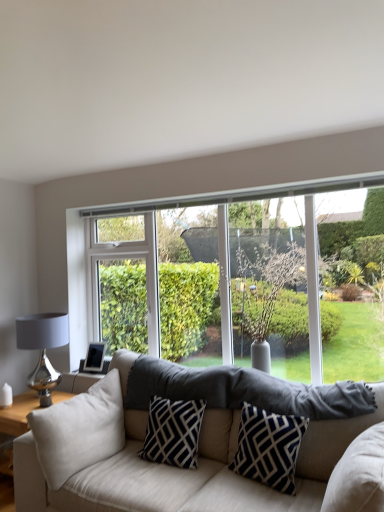
Question: Considering the positions of beige fabric couch at center and black/white geometric pillow at center, which is the second pillow from left to right, in the image, is beige fabric couch at center taller or shorter than black/white geometric pillow at center, which is the second pillow from left to right,?

Choices:
 (A) tall
 (B) short

Answer: (A)

Question: Considering the positions of beige fabric couch at center and black/white geometric pillow at center, the 2th pillow viewed from the right, in the image, is beige fabric couch at center wider or thinner than black/white geometric pillow at center, the 2th pillow viewed from the right,?

Choices:
 (A) thin
 (B) wide

Answer: (B)

Question: Which of these objects is positioned closest to the clear glass window at center?

Choices:
 (A) navy blue/white geometric pillow at center, which appears as the 3th pillow when viewed from the left
 (B) beige fabric couch at center
 (C) beige fabric pillow at lower left, the third pillow from the right
 (D) shiny metallic table lamp at left
 (E) black/white geometric pillow at center, the 2th pillow viewed from the right

Answer: (B)

Question: Estimate the real-world distances between objects in this image. Which object is closer to the clear glass window at center?

Choices:
 (A) beige fabric couch at center
 (B) navy blue/white geometric pillow at center, arranged as the 1th pillow when viewed from the right
 (C) black/white geometric pillow at center, the 2th pillow viewed from the right
 (D) beige fabric pillow at lower left, the 1th pillow in the left-to-right sequence
 (E) shiny metallic table lamp at left

Answer: (A)